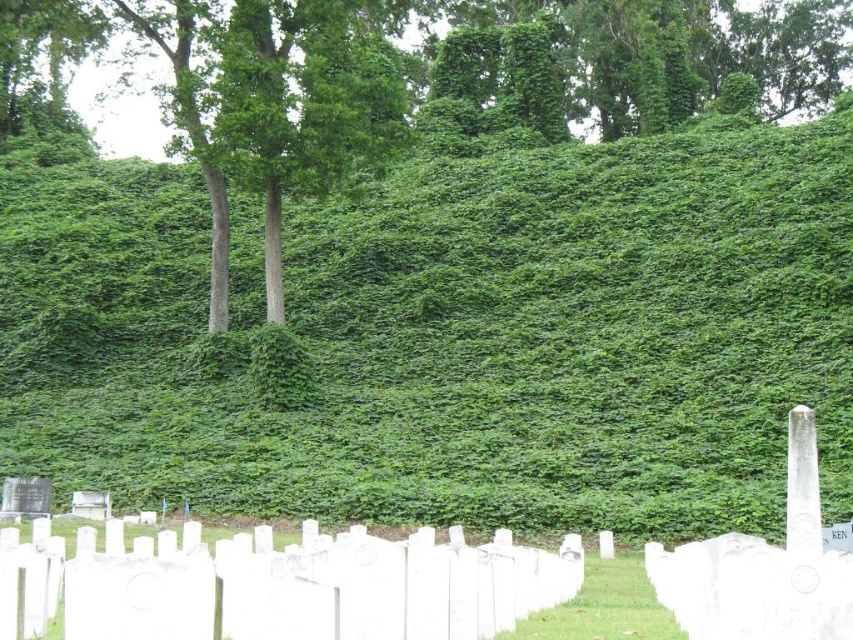
Is green leafy hillside at center to the right of green leafy tree at upper center from the viewer's perspective?

Correct, you'll find green leafy hillside at center to the right of green leafy tree at upper center.

Find the location of a particular element. green leafy hillside at center is located at coordinates (457, 337).

Is point (234, 384) positioned in front of point (178, 44)?

Yes.

Identify the location of green leafy hillside at center. (457, 337).